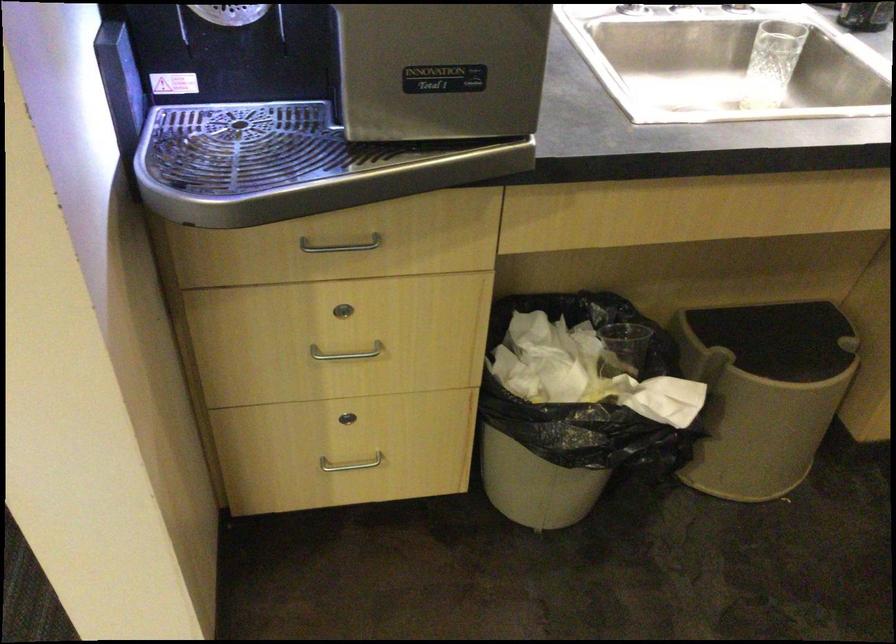
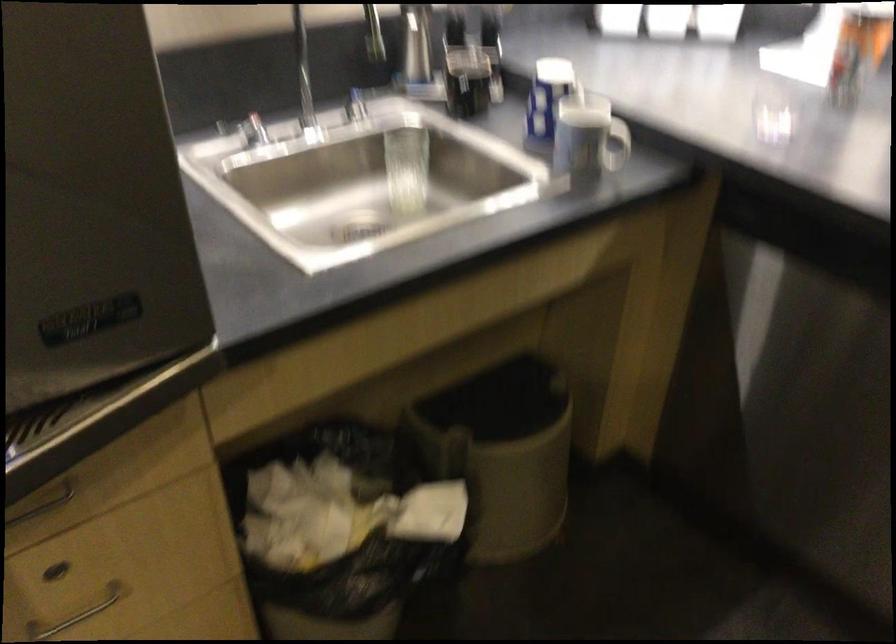
Question: Based on the continuous images, in which direction is the camera rotating? Reply with the corresponding letter.

Choices:
 (A) Left
 (B) Right
 (C) Up
 (D) Down

Answer: (B)